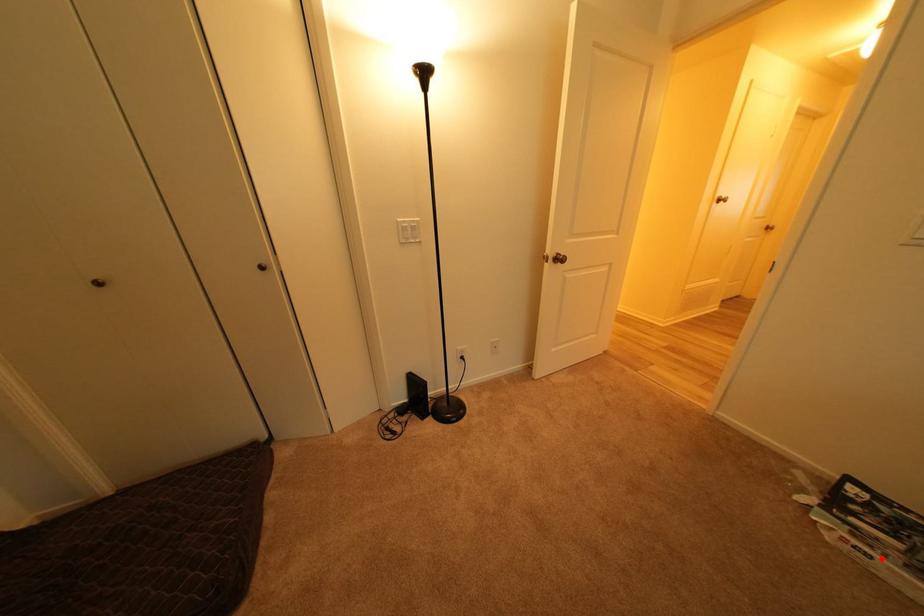
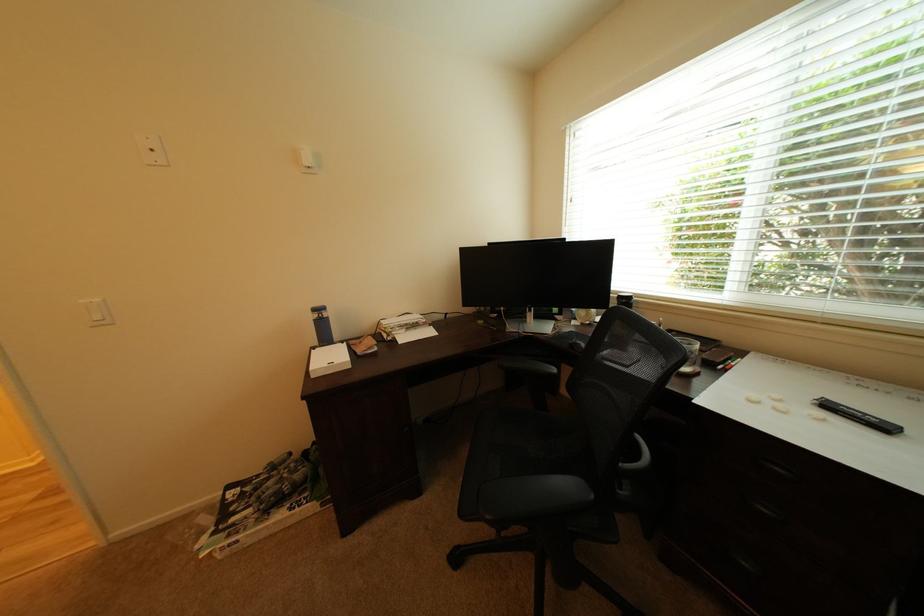
Question: I am providing you with two images of the same scene from different viewpoints. In image1, a red point is highlighted. Considering the same 3D point in image2, which of the following is correct?

Choices:
 (A) It is closer
 (B) It is farther

Answer: (A)